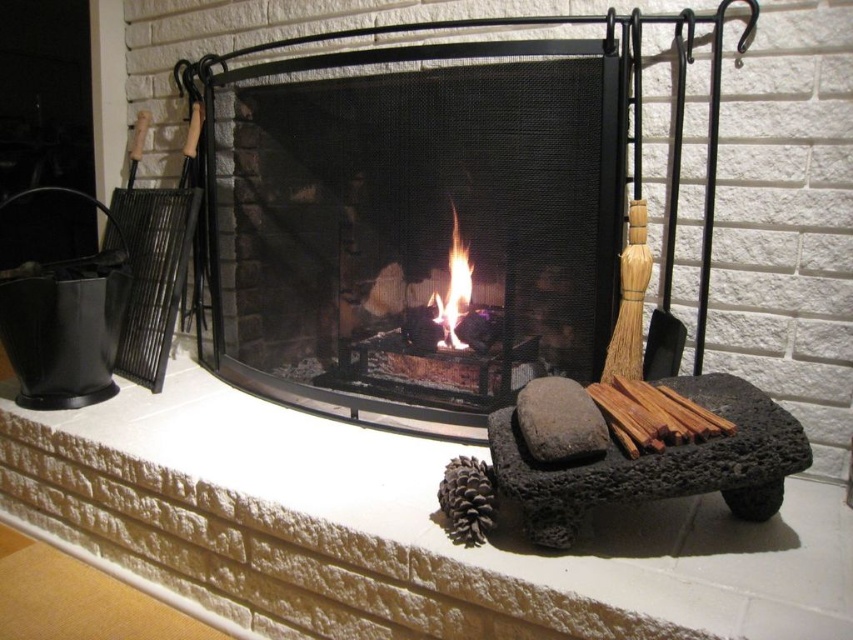
Looking at the cozy fireplace setup, where is the black mesh fireplace screen at center in relation to the flametransparentfire at center?

The black mesh fireplace screen at center is to the left of the flametransparentfire at center.

You are standing in front of the fireplace and notice two points marked in the scene. The first point is at coordinates point (337, 291) and the second is at point (473, 468). Which of these points is closer to you?

Point (337, 291) is closer to you because it is further to the camera than point (473, 468).

You are a guest in the room and want to ensure the fire is safely contained. Based on the scene, is the black mesh fireplace screen at center properly placed to contain the flametransparentfire at center?

The black mesh fireplace screen at center is positioned over the flametransparentfire at center, which means it is correctly placed to contain the flames and embers, ensuring safety.